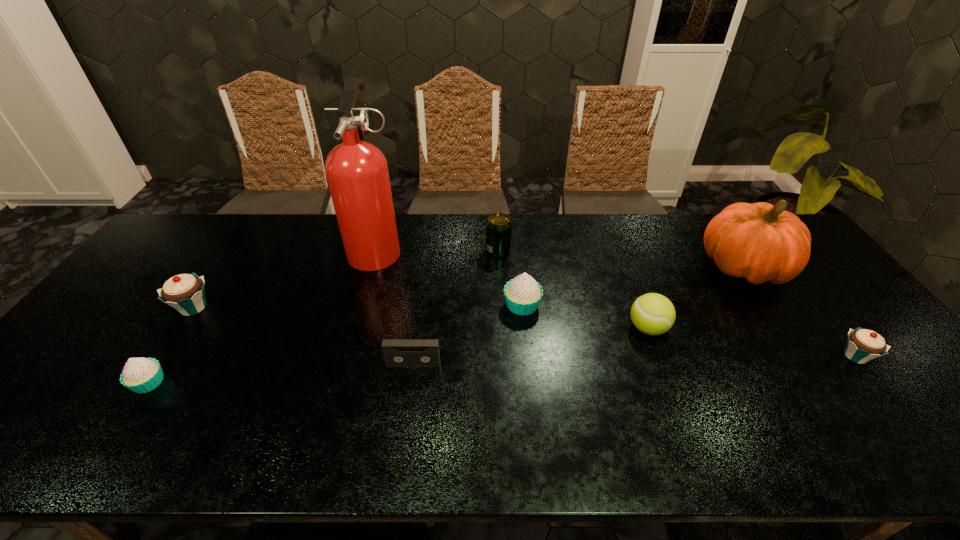
At what (x,y) coordinates should I click in order to perform the action: click on the tallest object. Please return your answer as a coordinate pair (x, y). This screenshot has height=540, width=960. Looking at the image, I should click on (357, 173).

Where is `the third object from left to right`? the third object from left to right is located at coordinates (357, 173).

I want to click on orange pumpkin, so click(x=760, y=242).

Identify the location of the eighth shortest object. (760, 242).

This screenshot has width=960, height=540. I want to click on green beer can, so click(x=498, y=225).

This screenshot has height=540, width=960. What are the coordinates of `the bigger white cupcake` in the screenshot? It's located at (523, 294).

Find the location of `the farther white cupcake`. the farther white cupcake is located at coordinates (523, 294).

This screenshot has width=960, height=540. Identify the location of the left teal cupcake. (185, 292).

This screenshot has width=960, height=540. I want to click on the farther teal cupcake, so click(185, 292).

At what (x,y) coordinates should I click in order to perform the action: click on the third object from right to left. Please return your answer as a coordinate pair (x, y). Looking at the image, I should click on coord(653,314).